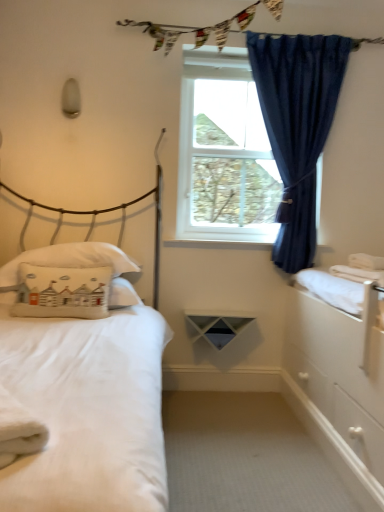
Question: Should I look upward or downward to see white glossy dresser at right?

Choices:
 (A) down
 (B) up

Answer: (A)

Question: Does white cotton pillow at left, marked as the 2th pillow in a front-to-back arrangement, come in front of white glossy dresser at right?

Choices:
 (A) no
 (B) yes

Answer: (A)

Question: From a real-world perspective, does white cotton pillow at left, which is counted as the first pillow, starting from the back, sit lower than white glossy dresser at right?

Choices:
 (A) no
 (B) yes

Answer: (A)

Question: From the image's perspective, is white cotton pillow at left, marked as the 2th pillow in a front-to-back arrangement, on top of white glossy dresser at right?

Choices:
 (A) yes
 (B) no

Answer: (A)

Question: Can you confirm if white cotton pillow at left, which is counted as the first pillow, starting from the back, is smaller than white glossy dresser at right?

Choices:
 (A) yes
 (B) no

Answer: (A)

Question: Is white cotton pillow at left, which is counted as the first pillow, starting from the back, wider than white glossy dresser at right?

Choices:
 (A) yes
 (B) no

Answer: (B)

Question: Could you tell me if white cotton pillow at left, marked as the 2th pillow in a front-to-back arrangement, is turned towards white glossy dresser at right?

Choices:
 (A) no
 (B) yes

Answer: (A)

Question: Is white plastic window at center shorter than white matte bed at left?

Choices:
 (A) no
 (B) yes

Answer: (B)

Question: From the image's perspective, is white plastic window at center under white matte bed at left?

Choices:
 (A) no
 (B) yes

Answer: (A)

Question: Is white plastic window at center next to white matte bed at left?

Choices:
 (A) yes
 (B) no

Answer: (B)

Question: Is white plastic window at center looking in the opposite direction of white matte bed at left?

Choices:
 (A) no
 (B) yes

Answer: (A)

Question: Does white plastic window at center appear on the right side of white matte bed at left?

Choices:
 (A) no
 (B) yes

Answer: (B)

Question: Is white plastic window at center behind white matte bed at left?

Choices:
 (A) no
 (B) yes

Answer: (B)

Question: Is white matte bed at left inside textured fabric clothesline at upper center?

Choices:
 (A) no
 (B) yes

Answer: (A)